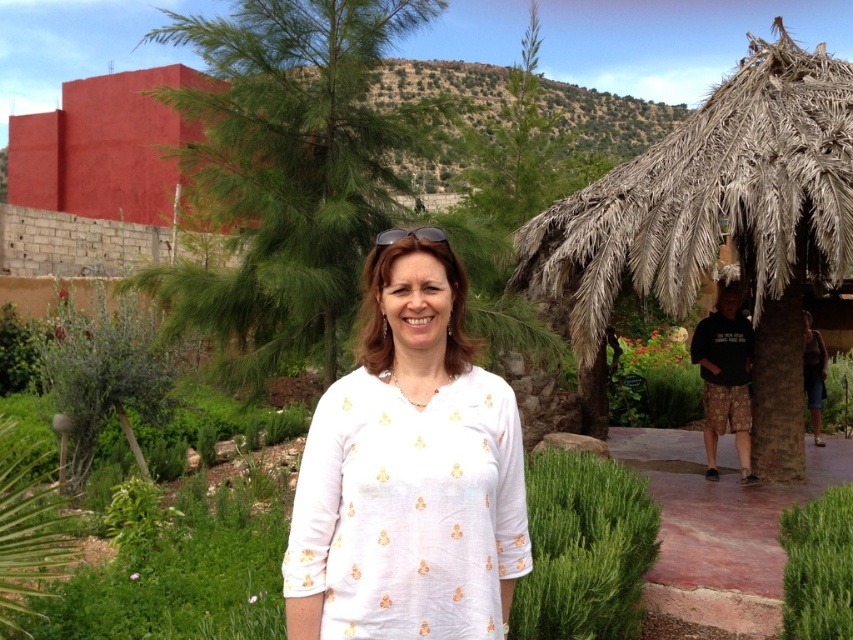
Question: Which of the following is the farthest from the observer?

Choices:
 (A) clear plastic goggles at center
 (B) green leafy bush at lower right

Answer: (B)

Question: Where is smooth red wall at upper left located in relation to green leafy bush at lower right in the image?

Choices:
 (A) right
 (B) left

Answer: (B)

Question: Which of the following is the farthest from the observer?

Choices:
 (A) (434, 227)
 (B) (647, 220)
 (C) (795, 589)
 (D) (643, 477)

Answer: (B)

Question: Which point is farther to the camera?

Choices:
 (A) white cotton blouse at center
 (B) clear plastic goggles at center

Answer: (A)

Question: Is the position of black cotton shorts at right less distant than that of white cotton blouse at center?

Choices:
 (A) yes
 (B) no

Answer: (A)

Question: Is smooth red wall at upper left thinner than white cotton blouse at center?

Choices:
 (A) yes
 (B) no

Answer: (B)